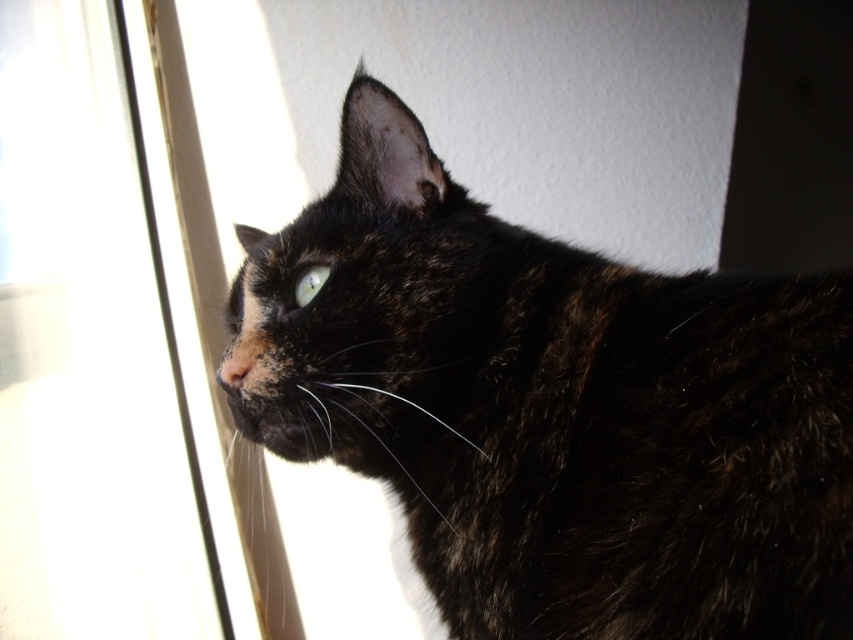
Question: In this image, where is tortoiseshell fur cat at upper left located relative to shiny green eye at upper center?

Choices:
 (A) left
 (B) right

Answer: (B)

Question: Estimate the real-world distances between objects in this image. Which object is farther from the tortoiseshell fur cat at upper left?

Choices:
 (A) shiny green eye at upper center
 (B) transparent glass window at left

Answer: (B)

Question: Which point is closer to the camera?

Choices:
 (A) transparent glass window at left
 (B) shiny green eye at upper center

Answer: (B)

Question: Which of the following is the closest to the observer?

Choices:
 (A) (755, 388)
 (B) (74, 440)
 (C) (316, 291)

Answer: (A)

Question: Does tortoiseshell fur cat at upper left lie behind transparent glass window at left?

Choices:
 (A) yes
 (B) no

Answer: (B)

Question: Does tortoiseshell fur cat at upper left appear on the left side of shiny green eye at upper center?

Choices:
 (A) yes
 (B) no

Answer: (B)